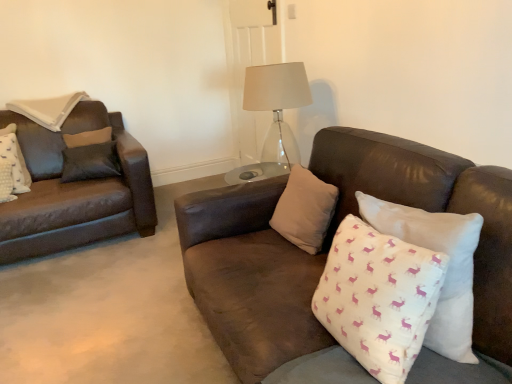
Question: Is the depth of white cotton pillow with pink deer pattern at center, the fourth pillow from the left, greater than that of transparent glass table lamp at center?

Choices:
 (A) no
 (B) yes

Answer: (A)

Question: Considering the relative positions of white cotton pillow with pink deer pattern at center, arranged as the 1th pillow when viewed from the right, and transparent glass table lamp at center in the image provided, is white cotton pillow with pink deer pattern at center, arranged as the 1th pillow when viewed from the right, to the left of transparent glass table lamp at center from the viewer's perspective?

Choices:
 (A) yes
 (B) no

Answer: (B)

Question: Does white cotton pillow with pink deer pattern at center, the fourth pillow from the left, have a greater height compared to transparent glass table lamp at center?

Choices:
 (A) yes
 (B) no

Answer: (B)

Question: Is white cotton pillow with pink deer pattern at center, the fourth pillow from the left, positioned in front of transparent glass table lamp at center?

Choices:
 (A) no
 (B) yes

Answer: (B)

Question: From a real-world perspective, relative to white textured pillow at left, which is counted as the first pillow, starting from the left, is white cotton cushion with pink deer pattern at right, which is the third pillow in left-to-right order, vertically above or below?

Choices:
 (A) above
 (B) below

Answer: (A)

Question: Choose the correct answer: Is white cotton cushion with pink deer pattern at right, placed as the second pillow when sorted from right to left, inside white textured pillow at left, which appears as the 4th pillow when viewed from the right, or outside it?

Choices:
 (A) inside
 (B) outside

Answer: (B)

Question: From the image's perspective, relative to white textured pillow at left, which is counted as the first pillow, starting from the left, is white cotton cushion with pink deer pattern at right, placed as the second pillow when sorted from right to left, above or below?

Choices:
 (A) above
 (B) below

Answer: (B)

Question: Is white cotton cushion with pink deer pattern at right, which is the third pillow in left-to-right order, in front of or behind white textured pillow at left, which is counted as the first pillow, starting from the left, in the image?

Choices:
 (A) front
 (B) behind

Answer: (A)

Question: Is white textured pillow at left, which appears as the 4th pillow when viewed from the right, situated inside transparent glass table lamp at center or outside?

Choices:
 (A) inside
 (B) outside

Answer: (B)

Question: Considering the positions of point (x=17, y=178) and point (x=290, y=77), is point (x=17, y=178) closer or farther from the camera than point (x=290, y=77)?

Choices:
 (A) closer
 (B) farther

Answer: (B)

Question: Considering the positions of white textured pillow at left, which appears as the 4th pillow when viewed from the right, and transparent glass table lamp at center in the image, is white textured pillow at left, which appears as the 4th pillow when viewed from the right, taller or shorter than transparent glass table lamp at center?

Choices:
 (A) short
 (B) tall

Answer: (A)

Question: From a real-world perspective, relative to transparent glass table lamp at center, is white textured pillow at left, which is counted as the first pillow, starting from the left, vertically above or below?

Choices:
 (A) above
 (B) below

Answer: (B)

Question: Is transparent glass table lamp at center spatially inside white textured pillow at left, which appears as the 4th pillow when viewed from the right, or outside of it?

Choices:
 (A) outside
 (B) inside

Answer: (A)

Question: Is transparent glass table lamp at center bigger or smaller than white textured pillow at left, which appears as the 4th pillow when viewed from the right?

Choices:
 (A) big
 (B) small

Answer: (A)